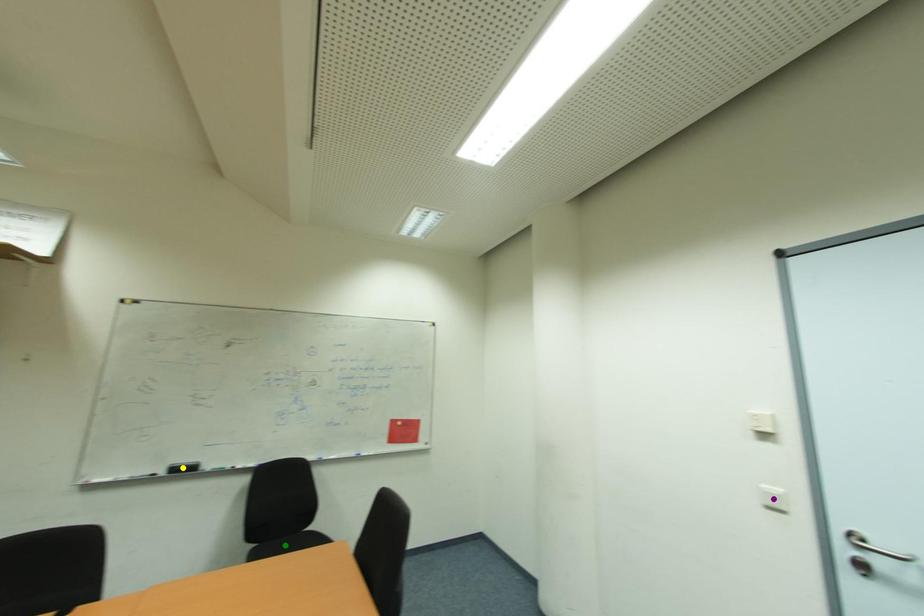
Order these from nearest to farthest:
purple point, yellow point, green point

green point
yellow point
purple point